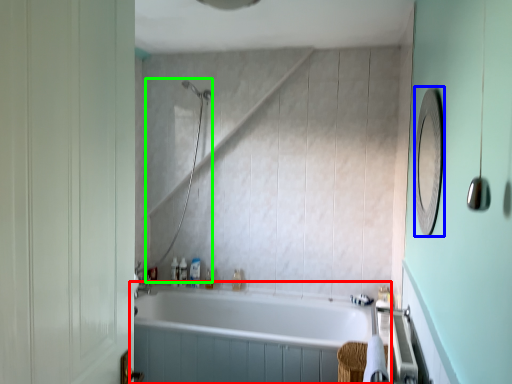
Question: Considering the real-world distances, which object is closest to bathtub (highlighted by a red box)? mirror (highlighted by a blue box) or shower (highlighted by a green box).

Choices:
 (A) mirror
 (B) shower

Answer: (B)